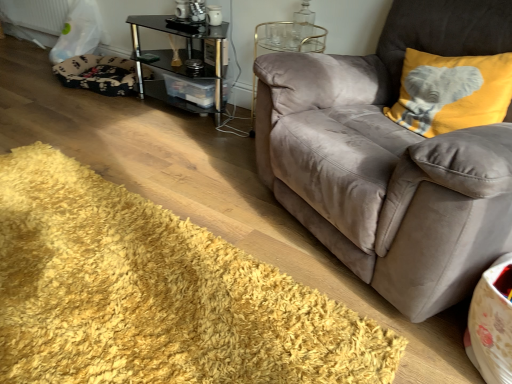
Question: From a real-world perspective, is suede gray couch at right physically below yellow shaggy rug at lower left?

Choices:
 (A) yes
 (B) no

Answer: (B)

Question: Considering the relative positions of suede gray couch at right and yellow shaggy rug at lower left in the image provided, is suede gray couch at right to the right of yellow shaggy rug at lower left from the viewer's perspective?

Choices:
 (A) no
 (B) yes

Answer: (B)

Question: Is suede gray couch at right to the left of yellow shaggy rug at lower left from the viewer's perspective?

Choices:
 (A) no
 (B) yes

Answer: (A)

Question: Does suede gray couch at right have a greater width compared to yellow shaggy rug at lower left?

Choices:
 (A) no
 (B) yes

Answer: (B)

Question: Is suede gray couch at right facing away from yellow shaggy rug at lower left?

Choices:
 (A) no
 (B) yes

Answer: (A)

Question: Does suede gray couch at right have a lesser width compared to yellow shaggy rug at lower left?

Choices:
 (A) yes
 (B) no

Answer: (B)

Question: From the image's perspective, is yellow shaggy rug at lower left over black glass table at center?

Choices:
 (A) yes
 (B) no

Answer: (B)

Question: Can you confirm if yellow shaggy rug at lower left is bigger than black glass table at center?

Choices:
 (A) yes
 (B) no

Answer: (B)

Question: Is yellow shaggy rug at lower left completely or partially outside of black glass table at center?

Choices:
 (A) yes
 (B) no

Answer: (A)

Question: Is yellow shaggy rug at lower left positioned behind black glass table at center?

Choices:
 (A) yes
 (B) no

Answer: (B)

Question: From a real-world perspective, is yellow shaggy rug at lower left positioned over black glass table at center based on gravity?

Choices:
 (A) no
 (B) yes

Answer: (A)

Question: Is yellow shaggy rug at lower left positioned with its back to black glass table at center?

Choices:
 (A) yes
 (B) no

Answer: (B)

Question: From a real-world perspective, does yellow shaggy rug at lower left stand above fluffy black and white dog bed at lower left?

Choices:
 (A) no
 (B) yes

Answer: (A)